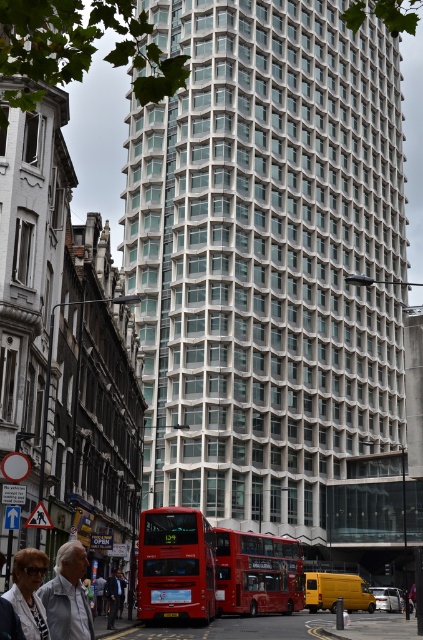
Is red matte double-decker bus at center closer to camera compared to white fabric jacket at lower left?

No, red matte double-decker bus at center is behind white fabric jacket at lower left.

Who is more distant from viewer, (167, 612) or (65, 595)?

The point (167, 612) is more distant.

The image size is (423, 640). What are the coordinates of `red matte double-decker bus at center` in the screenshot? It's located at (175, 564).

Can you confirm if matte red bus at center is bigger than matte black jacket at lower left?

Indeed, matte red bus at center has a larger size compared to matte black jacket at lower left.

Does matte red bus at center have a lesser height compared to matte black jacket at lower left?

Incorrect, matte red bus at center's height does not fall short of matte black jacket at lower left's.

You are a GUI agent. You are given a task and a screenshot of the screen. Output one action in this format:
    pyautogui.click(x=<x>, y=<y>)
    Task: Click on the matte red bus at center
    
    Given the screenshot: What is the action you would take?
    pyautogui.click(x=258, y=573)

Which of these two, red matte double-decker bus at center or matte black jacket at lower left, stands taller?

red matte double-decker bus at center

How far apart are red matte double-decker bus at center and matte black jacket at lower left?

red matte double-decker bus at center and matte black jacket at lower left are 28.38 meters apart from each other.

This screenshot has height=640, width=423. What are the coordinates of `red matte double-decker bus at center` in the screenshot? It's located at (175, 564).